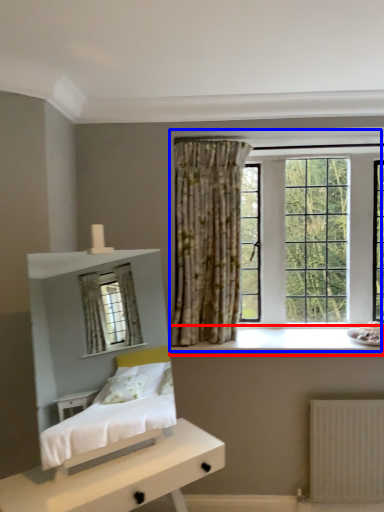
Question: Which point is closer to the camera, window sill (highlighted by a red box) or window (highlighted by a blue box)?

Choices:
 (A) window sill
 (B) window

Answer: (A)